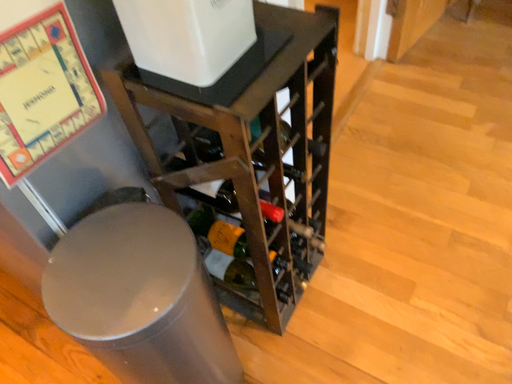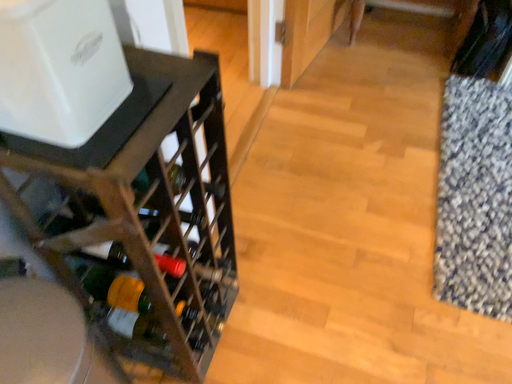
Question: Which way did the camera rotate in the video?

Choices:
 (A) rotated left
 (B) rotated right

Answer: (B)